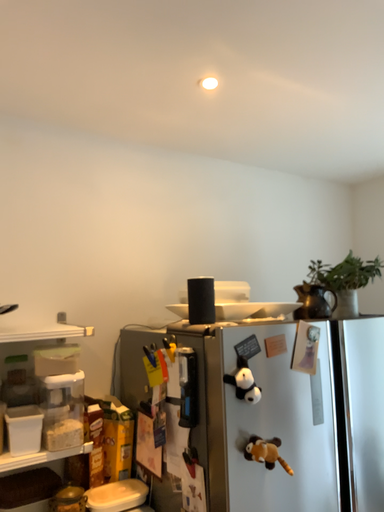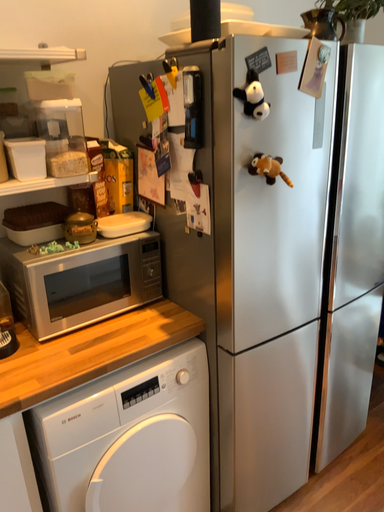
Question: Which way did the camera rotate in the video?

Choices:
 (A) rotated downward
 (B) rotated upward

Answer: (A)